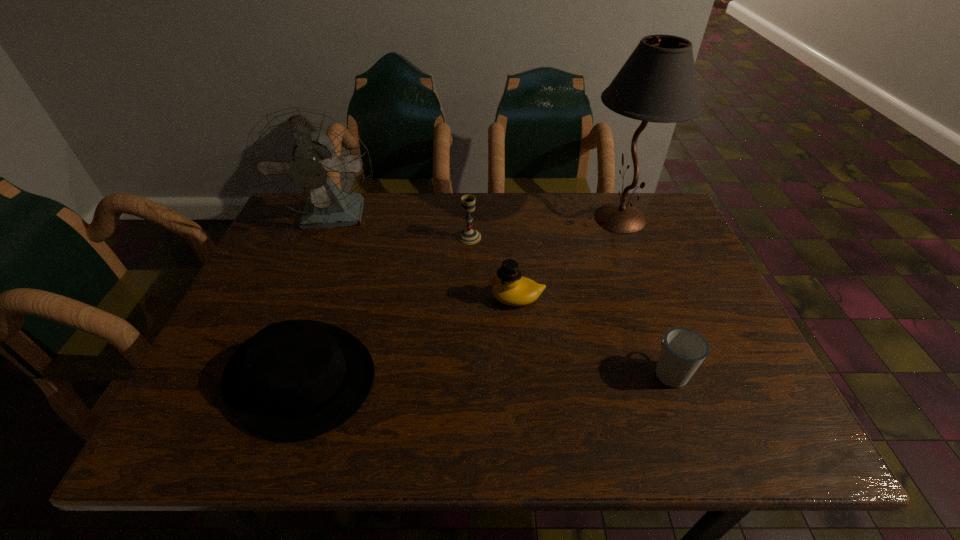
Find the location of a particular element. Image resolution: width=960 pixels, height=540 pixels. free region that satisfies the following two spatial constraints: 1. in front of the second tallest object to blow air; 2. on the right side of the chalice is located at coordinates pyautogui.click(x=328, y=237).